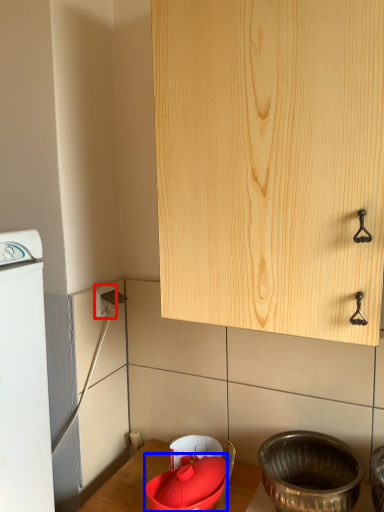
Question: Which of the following is the farthest to the observer, electric outlet (highlighted by a red box) or basin (highlighted by a blue box)?

Choices:
 (A) electric outlet
 (B) basin

Answer: (A)